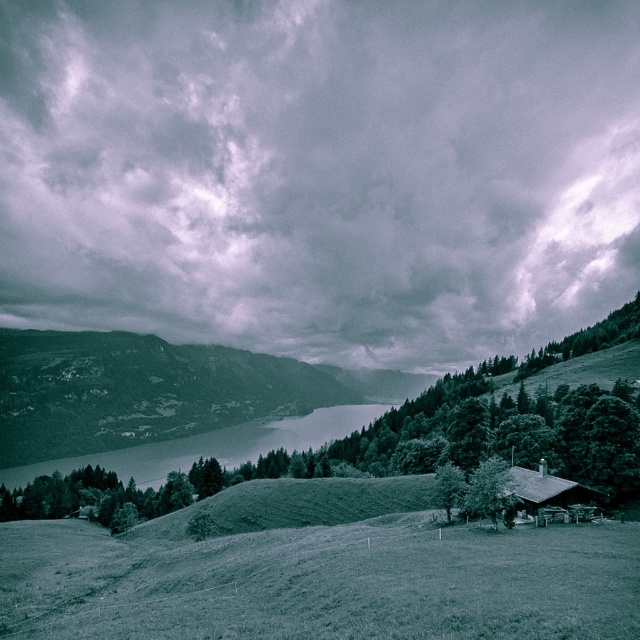
Between cloudy sky at upper center and green leafy tree at lower right, which one appears on the left side from the viewer's perspective?

Positioned to the left is cloudy sky at upper center.

Does point (442, 33) lie in front of point (435, 474)?

That is False.

I want to click on cloudy sky at upper center, so click(x=321, y=172).

Is smooth water at center taller than wooden cabin at center-right?

Yes, smooth water at center is taller than wooden cabin at center-right.

Does smooth water at center appear on the left side of wooden cabin at center-right?

Correct, you'll find smooth water at center to the left of wooden cabin at center-right.

Locate an element on the screen. This screenshot has height=640, width=640. smooth water at center is located at coordinates (211, 445).

Can you confirm if smooth water at center is wider than green matte tree at lower right?

Yes, smooth water at center is wider than green matte tree at lower right.

Who is more distant from viewer, (168,467) or (467,499)?

Point (168,467)

The image size is (640, 640). Find the location of `smooth water at center`. smooth water at center is located at coordinates (211, 445).